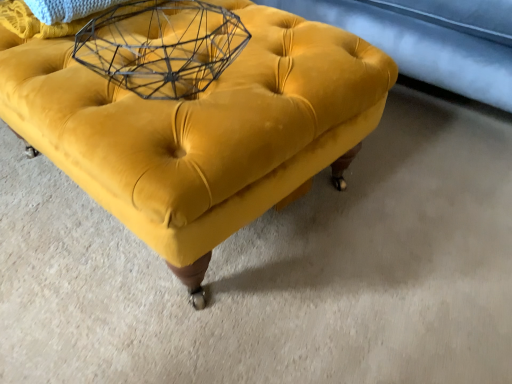
The width and height of the screenshot is (512, 384). What do you see at coordinates (199, 127) in the screenshot?
I see `velvet yellow ottoman at center` at bounding box center [199, 127].

Find the location of a particular element. The width and height of the screenshot is (512, 384). velvet yellow ottoman at center is located at coordinates (199, 127).

Measure the distance between point (132, 173) and camera.

The distance of point (132, 173) from camera is 22.44 inches.

Find the location of a particular element. The width and height of the screenshot is (512, 384). wire mesh basket at upper center is located at coordinates (161, 46).

This screenshot has width=512, height=384. Describe the element at coordinates (161, 46) in the screenshot. I see `wire mesh basket at upper center` at that location.

You are a GUI agent. You are given a task and a screenshot of the screen. Output one action in this format:
    pyautogui.click(x=<x>, y=<y>)
    Task: Click on the velvet yellow ottoman at center
    The width and height of the screenshot is (512, 384).
    Given the screenshot: What is the action you would take?
    pyautogui.click(x=199, y=127)

Would you say wire mesh basket at upper center is to the left or to the right of velvet yellow ottoman at center in the picture?

Clearly, wire mesh basket at upper center is on the left of velvet yellow ottoman at center in the image.

Considering the positions of objects wire mesh basket at upper center and velvet yellow ottoman at center in the image provided, who is behind, wire mesh basket at upper center or velvet yellow ottoman at center?

wire mesh basket at upper center is further from the camera.

Does point (209, 47) appear closer or farther from the camera than point (252, 90)?

Clearly, point (209, 47) is more distant from the camera than point (252, 90).

From the image's perspective, is wire mesh basket at upper center above or below velvet yellow ottoman at center?

wire mesh basket at upper center is above velvet yellow ottoman at center.

From a real-world perspective, between wire mesh basket at upper center and velvet yellow ottoman at center, who is vertically lower?

velvet yellow ottoman at center is physically lower.

Is wire mesh basket at upper center wider than velvet yellow ottoman at center?

No, wire mesh basket at upper center is not wider than velvet yellow ottoman at center.

Is wire mesh basket at upper center taller or shorter than velvet yellow ottoman at center?

wire mesh basket at upper center is shorter than velvet yellow ottoman at center.

Does wire mesh basket at upper center have a smaller size compared to velvet yellow ottoman at center?

Correct, wire mesh basket at upper center occupies less space than velvet yellow ottoman at center.

Is wire mesh basket at upper center spatially inside velvet yellow ottoman at center, or outside of it?

wire mesh basket at upper center can be found inside velvet yellow ottoman at center.

Is wire mesh basket at upper center not near velvet yellow ottoman at center?

No, wire mesh basket at upper center is not far away from velvet yellow ottoman at center.

Does wire mesh basket at upper center turn towards velvet yellow ottoman at center?

No.

How different are the orientations of wire mesh basket at upper center and velvet yellow ottoman at center in degrees?

1.46 degrees separate the facing orientations of wire mesh basket at upper center and velvet yellow ottoman at center.

You are a GUI agent. You are given a task and a screenshot of the screen. Output one action in this format:
    pyautogui.click(x=<x>, y=<y>)
    Task: Click on the round table lying on the left of velvet yellow ottoman at center
    
    Given the screenshot: What is the action you would take?
    pyautogui.click(x=161, y=46)

Is velvet yellow ottoman at center to the left of wire mesh basket at upper center from the viewer's perspective?

In fact, velvet yellow ottoman at center is to the right of wire mesh basket at upper center.

Looking at this image, considering their positions, is velvet yellow ottoman at center located in front of or behind wire mesh basket at upper center?

velvet yellow ottoman at center is positioned closer to the viewer than wire mesh basket at upper center.

Between point (242, 77) and point (199, 43), which one is positioned in front?

The point (242, 77) is in front.

Consider the image. From the image's perspective, relative to wire mesh basket at upper center, is velvet yellow ottoman at center above or below?

velvet yellow ottoman at center is situated lower than wire mesh basket at upper center in the image.

From a real-world perspective, is velvet yellow ottoman at center above or below wire mesh basket at upper center?

Clearly, from a real-world perspective, velvet yellow ottoman at center is below wire mesh basket at upper center.

Can you confirm if velvet yellow ottoman at center is thinner than wire mesh basket at upper center?

In fact, velvet yellow ottoman at center might be wider than wire mesh basket at upper center.

Between velvet yellow ottoman at center and wire mesh basket at upper center, which one has less height?

wire mesh basket at upper center is shorter.

Is velvet yellow ottoman at center bigger than wire mesh basket at upper center?

Yes.

Can we say velvet yellow ottoman at center lies outside wire mesh basket at upper center?

Yes, velvet yellow ottoman at center is located beyond the bounds of wire mesh basket at upper center.

Can you see velvet yellow ottoman at center touching wire mesh basket at upper center?

No, velvet yellow ottoman at center is not with wire mesh basket at upper center.

Could you tell me if velvet yellow ottoman at center is turned towards wire mesh basket at upper center?

No, velvet yellow ottoman at center is not oriented towards wire mesh basket at upper center.

You are a GUI agent. You are given a task and a screenshot of the screen. Output one action in this format:
    pyautogui.click(x=<x>, y=<y>)
    Task: Click on the round table located on the left of velvet yellow ottoman at center
    The image size is (512, 384).
    Given the screenshot: What is the action you would take?
    pyautogui.click(x=161, y=46)

Where is `furniture beneath the wire mesh basket at upper center (from a real-world perspective)`? The width and height of the screenshot is (512, 384). furniture beneath the wire mesh basket at upper center (from a real-world perspective) is located at coordinates (199, 127).

You are a GUI agent. You are given a task and a screenshot of the screen. Output one action in this format:
    pyautogui.click(x=<x>, y=<y>)
    Task: Click on the furniture that appears below the wire mesh basket at upper center (from the image's perspective)
    Image resolution: width=512 pixels, height=384 pixels.
    Given the screenshot: What is the action you would take?
    pyautogui.click(x=199, y=127)